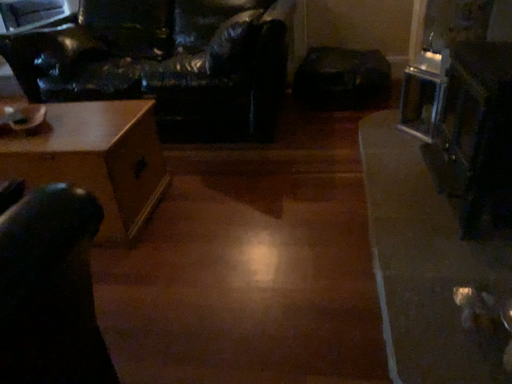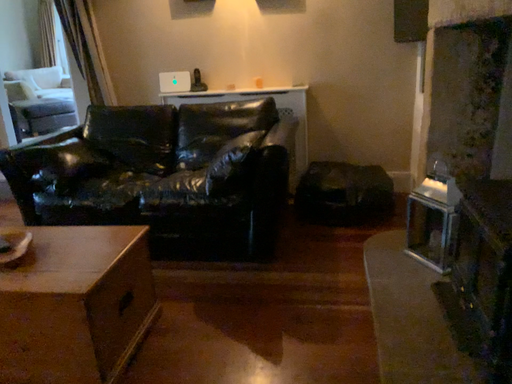
Question: Which way did the camera rotate in the video?

Choices:
 (A) rotated upward
 (B) rotated downward

Answer: (A)